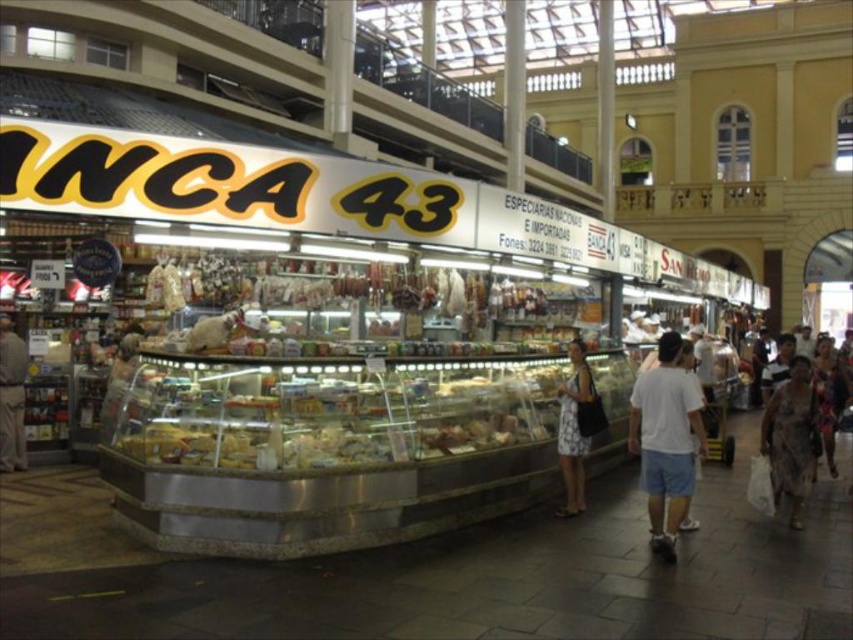
Which of these two, patterned fabric dress at lower right or white floral dress at center, stands shorter?

patterned fabric dress at lower right is shorter.

Which is in front, point (778, 468) or point (563, 429)?

Point (778, 468)

Between point (811, 460) and point (582, 488), which one is positioned in front?

Point (811, 460) is more forward.

The width and height of the screenshot is (853, 640). Identify the location of patterned fabric dress at lower right. (791, 436).

Is point (572, 467) positioned in front of point (813, 355)?

Yes, point (572, 467) is in front of point (813, 355).

Is point (570, 465) farther from viewer compared to point (833, 372)?

No, it is in front of (833, 372).

In order to click on white floral dress at center in this screenshot , I will do `click(573, 428)`.

Can you confirm if white cotton shirt at right is wider than white floral dress at center?

Yes.

Between white cotton shirt at right and white floral dress at center, which one is positioned higher?

white floral dress at center

Which is behind, point (651, 400) or point (573, 403)?

The point (573, 403) is behind.

I want to click on white cotton shirt at right, so click(x=666, y=440).